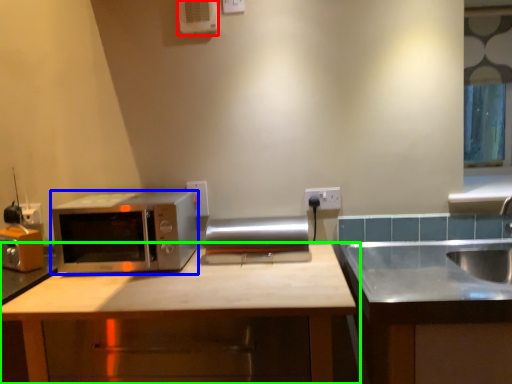
Question: Which is nearer to the air conditioner (highlighted by a red box)? microwave oven (highlighted by a blue box) or cabinetry (highlighted by a green box).

Choices:
 (A) microwave oven
 (B) cabinetry

Answer: (A)